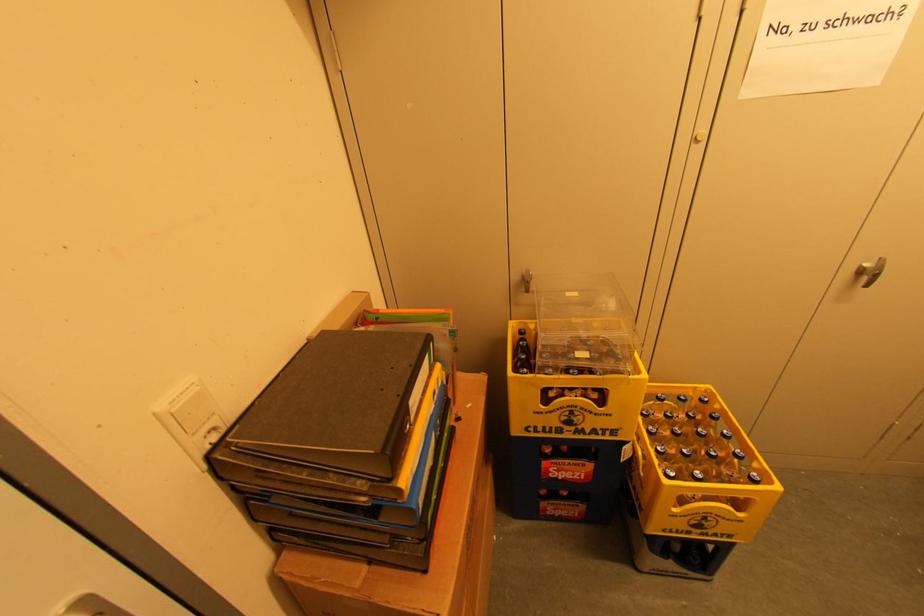
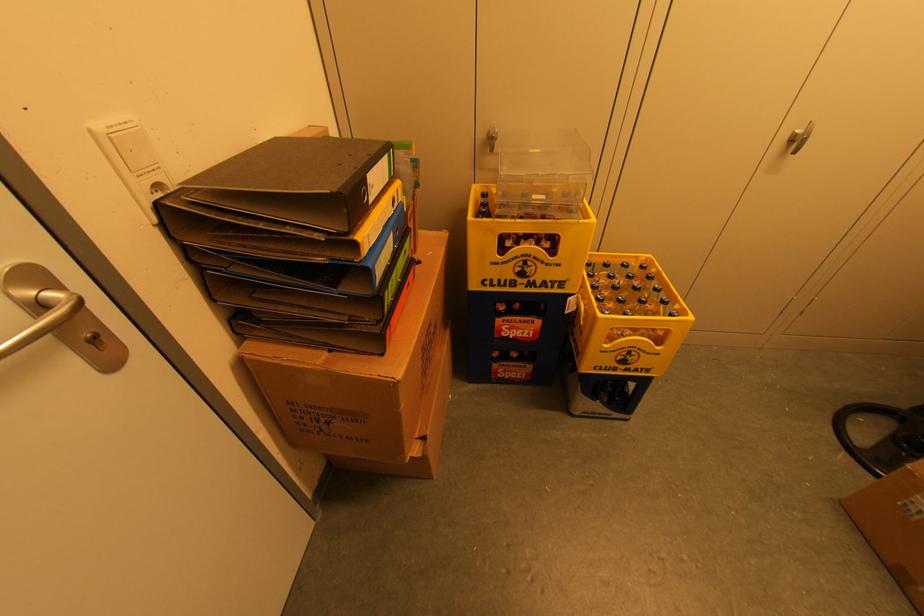
Question: A red point is marked in image1. In image2, is the corresponding 3D point closer to the camera or farther? Reply with the corresponding letter.

Choices:
 (A) The corresponding 3D point is closer.
 (B) The corresponding 3D point is farther.

Answer: (A)